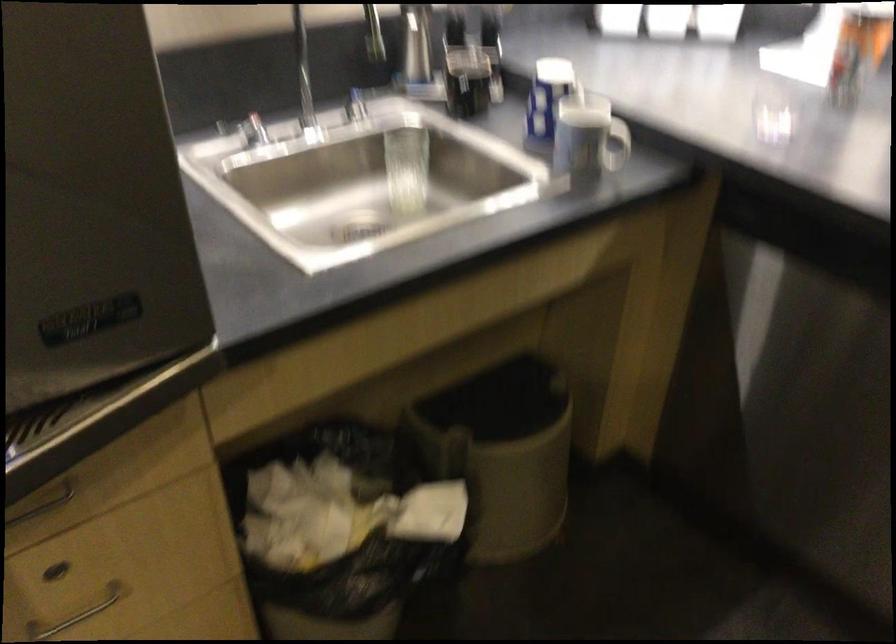
Where would you lift the white mug handle? Please return your answer as a coordinate pair (x, y).

(616, 146)